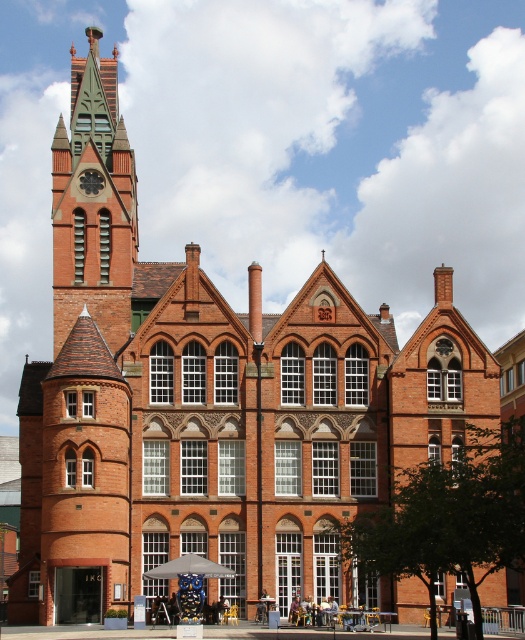
You are standing in front of the red brick building and want to take a photo of the gray fabric umbrella at center. To include the green glass clock tower at upper left in the frame, should you pan your camera to the left or right?

The green glass clock tower at upper left is positioned on the left side of gray fabric umbrella at center. To include it in the photo, you should pan your camera to the left.

You are standing in front of the red brick building and want to take a photo of the green glass clock tower at upper left. What is the exact 2D coordinate point where you should aim your camera?

The green glass clock tower at upper left is located at the 2D coordinate point of (x=93, y=202).